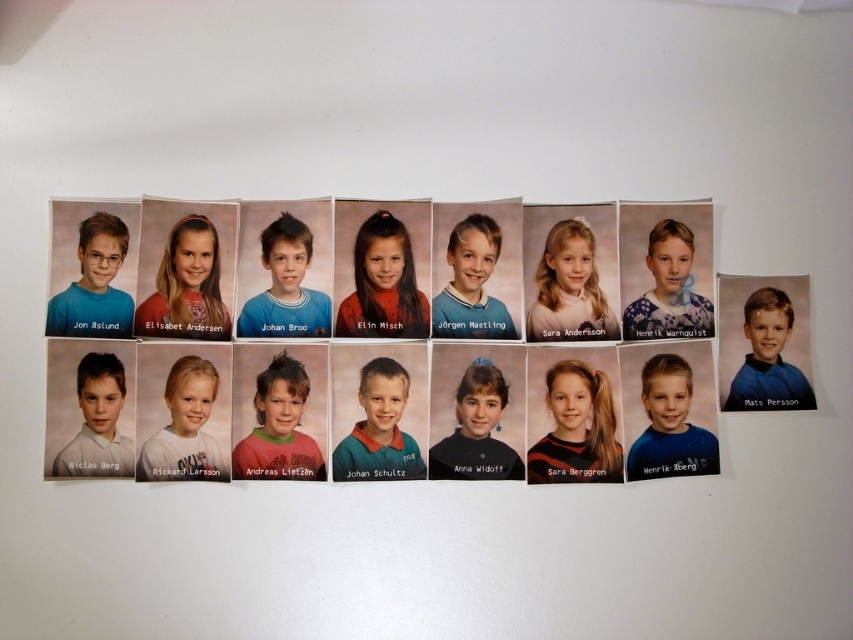
Which of these two, matte black hair at center or matte blue shirt at lower right, stands taller?

matte black hair at center

Looking at this image, is matte black hair at center smaller than matte blue shirt at lower right?

Actually, matte black hair at center might be larger than matte blue shirt at lower right.

At what (x,y) coordinates should I click in order to perform the action: click on matte black hair at center. Please return your answer as a coordinate pair (x, y). Image resolution: width=853 pixels, height=640 pixels. Looking at the image, I should click on (477, 412).

Who is higher up, blue shirt at center or matte blue shirt at lower right?

blue shirt at center is above.

From the picture: Who is more distant from viewer, (473, 285) or (759, 339)?

The point (473, 285) is more distant.

Where is `blue shirt at center`? The height and width of the screenshot is (640, 853). blue shirt at center is located at coordinates (471, 284).

The image size is (853, 640). I want to click on blue shirt at center, so click(471, 284).

Which is above, matte red shirt at center or blue shirt at center?

blue shirt at center is above.

Is point (358, 308) farther from viewer compared to point (498, 225)?

No, it is not.

Between point (374, 246) and point (457, 205), which one is positioned behind?

Positioned behind is point (457, 205).

Locate an element on the screen. The width and height of the screenshot is (853, 640). matte red shirt at center is located at coordinates coord(383,284).